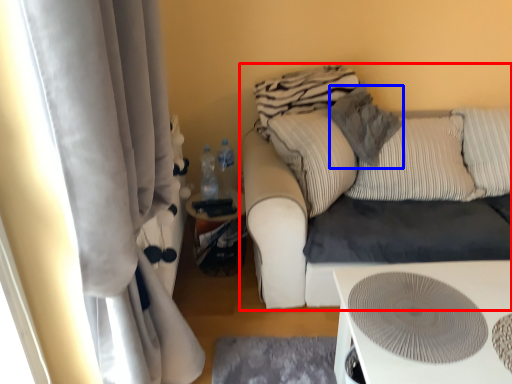
Question: Which object is closer to the camera taking this photo, studio couch (highlighted by a red box) or pillow (highlighted by a blue box)?

Choices:
 (A) studio couch
 (B) pillow

Answer: (A)